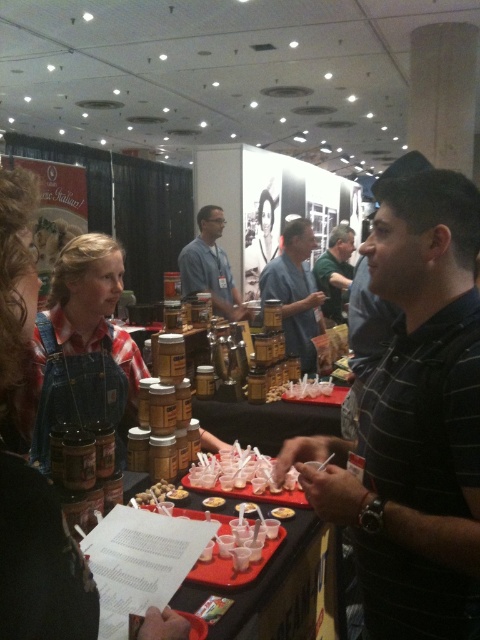
You are at a trade show booth and see two points marked on the table. The first point is at coordinate point [321,259] and the second is at point [178,490]. Which point is closer to you?

Point [321,259] is further to the camera than point [178,490]. Therefore, the point closer to you is point [178,490].

You are organizing a tasting event and need to ensure that the green fabric shirt at center and the matte brown jar at center are visible to attendees. Given their sizes, which one might require a more elevated display to ensure visibility?

The green fabric shirt at center is larger than the matte brown jar at center, so it might require a more elevated display to ensure visibility.